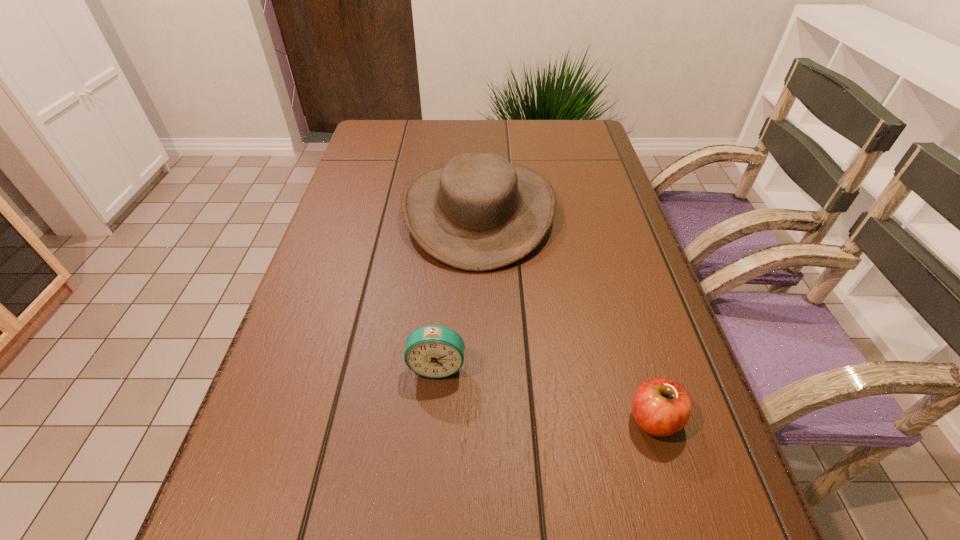
Identify the location of cowboy hat. (478, 212).

I want to click on the farthest object, so click(478, 212).

This screenshot has height=540, width=960. In order to click on the second shortest object in this screenshot , I will do `click(435, 351)`.

Where is `the second nearest object`? Image resolution: width=960 pixels, height=540 pixels. the second nearest object is located at coordinates (435, 351).

Image resolution: width=960 pixels, height=540 pixels. In order to click on the nearest object in this screenshot , I will do `click(661, 407)`.

I want to click on the shortest object, so click(661, 407).

Image resolution: width=960 pixels, height=540 pixels. I want to click on vacant area situated on the left of the farthest object, so (385, 211).

In order to click on free space located 0.130m on the front-facing side of the alarm clock in this screenshot , I will do `click(430, 454)`.

At what (x,y) coordinates should I click in order to perform the action: click on free space located on the back of the shortest object. Please return your answer as a coordinate pair (x, y). Looking at the image, I should click on 602,243.

The image size is (960, 540). Find the location of `object positioned at the right edge`. object positioned at the right edge is located at coordinates (661, 407).